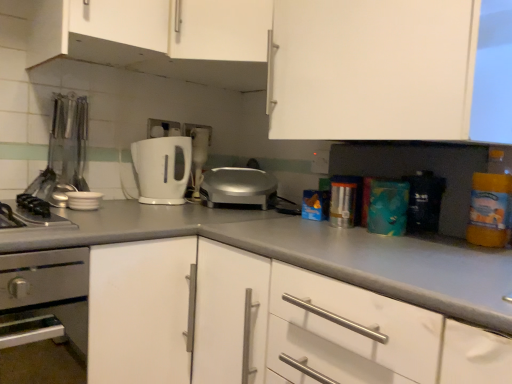
Find the location of `free point below white glossy toaster at center, acting as the second toaster starting from the right (from a real-world perspective)`. free point below white glossy toaster at center, acting as the second toaster starting from the right (from a real-world perspective) is located at coordinates pyautogui.click(x=149, y=199).